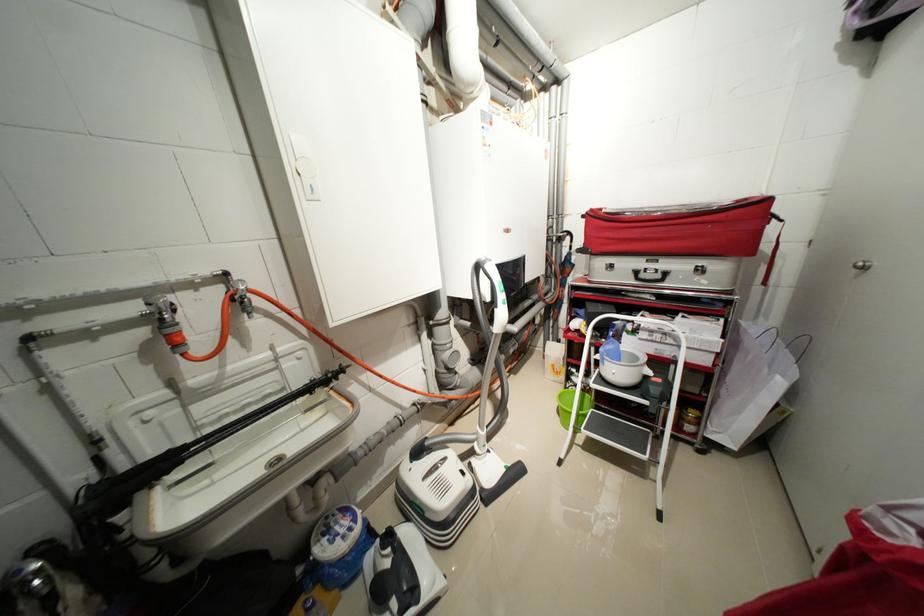
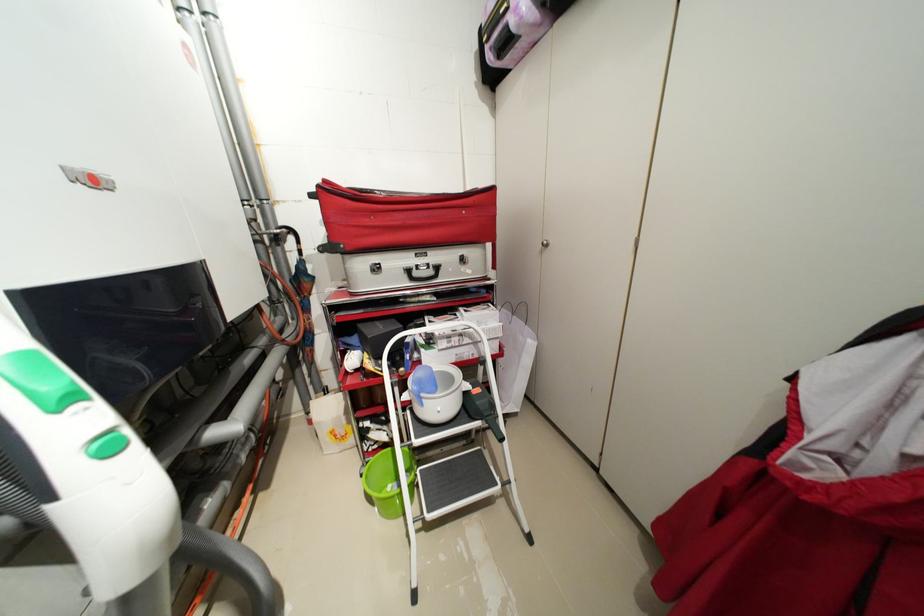
The point at (x=650, y=276) is marked in the first image. Where is the corresponding point in the second image?

(422, 275)